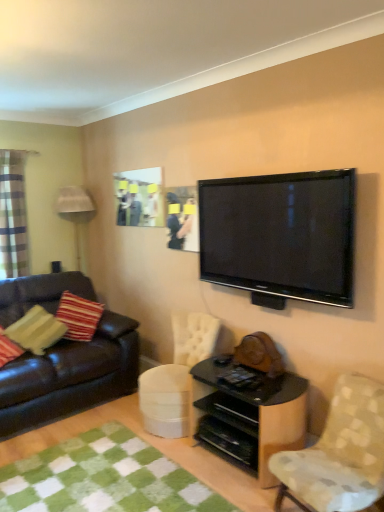
Question: Is green checkered rug at lower left far from black glossy shelf at lower center?

Choices:
 (A) yes
 (B) no

Answer: (B)

Question: Does green checkered rug at lower left lie in front of black glossy shelf at lower center?

Choices:
 (A) no
 (B) yes

Answer: (B)

Question: Considering the relative sizes of green checkered rug at lower left and black glossy shelf at lower center in the image provided, is green checkered rug at lower left smaller than black glossy shelf at lower center?

Choices:
 (A) yes
 (B) no

Answer: (A)

Question: From a real-world perspective, is green checkered rug at lower left beneath black glossy shelf at lower center?

Choices:
 (A) no
 (B) yes

Answer: (B)

Question: Does green checkered rug at lower left have a greater height compared to black glossy shelf at lower center?

Choices:
 (A) no
 (B) yes

Answer: (A)

Question: From a real-world perspective, is green checkered rug at lower left on top of black glossy shelf at lower center?

Choices:
 (A) yes
 (B) no

Answer: (B)

Question: Are striped fabric pillow at left and plaid fabric curtain at left beside each other?

Choices:
 (A) yes
 (B) no

Answer: (B)

Question: Can you confirm if striped fabric pillow at left is shorter than plaid fabric curtain at left?

Choices:
 (A) no
 (B) yes

Answer: (B)

Question: Is striped fabric pillow at left positioned with its back to plaid fabric curtain at left?

Choices:
 (A) no
 (B) yes

Answer: (A)

Question: Considering the relative positions of striped fabric pillow at left and plaid fabric curtain at left in the image provided, is striped fabric pillow at left to the right of plaid fabric curtain at left from the viewer's perspective?

Choices:
 (A) yes
 (B) no

Answer: (A)

Question: Does striped fabric pillow at left have a lesser width compared to plaid fabric curtain at left?

Choices:
 (A) yes
 (B) no

Answer: (B)

Question: Is striped fabric pillow at left not near plaid fabric curtain at left?

Choices:
 (A) no
 (B) yes

Answer: (A)

Question: Does patterned fabric chair at lower right appear on the right side of plaid fabric curtain at left?

Choices:
 (A) yes
 (B) no

Answer: (A)